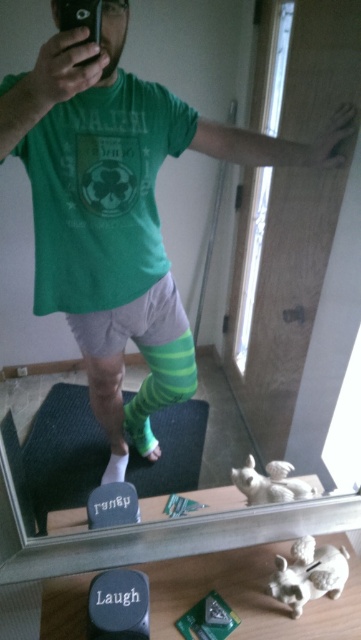
Question: Among these objects, which one is nearest to the camera?

Choices:
 (A) black plastic phone at upper left
 (B) green striped sock at lower left
 (C) green knitted sock at lower center

Answer: (A)

Question: Can you confirm if black plastic phone at upper left is smaller than green striped sock at lower left?

Choices:
 (A) yes
 (B) no

Answer: (B)

Question: Which of the following is the closest to the observer?

Choices:
 (A) green knitted sock at lower center
 (B) green striped sock at lower left
 (C) black plastic phone at upper left

Answer: (C)

Question: Which point is farther from the camera taking this photo?

Choices:
 (A) (116, 458)
 (B) (76, 26)

Answer: (A)

Question: Can you confirm if black plastic phone at upper left is thinner than green knitted sock at lower center?

Choices:
 (A) no
 (B) yes

Answer: (B)

Question: From the image, what is the correct spatial relationship of green knitted sock at lower center in relation to green striped sock at lower left?

Choices:
 (A) above
 (B) below

Answer: (A)